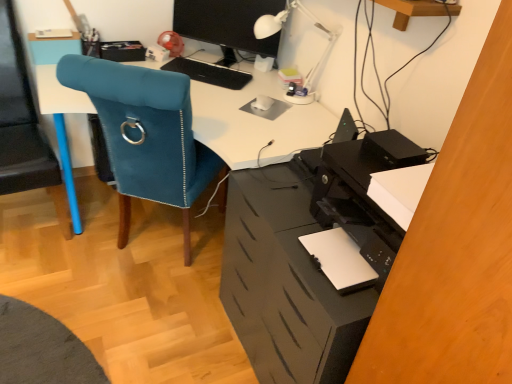
Identify the location of free point below black matte keyboard at center (from a real-world perspective). (209, 74).